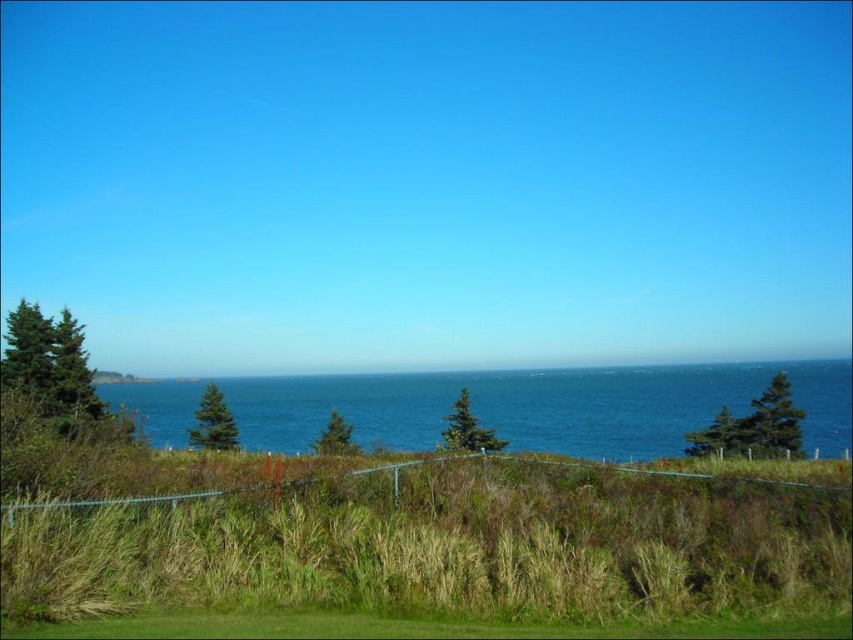
Question: Can you confirm if green grassy at lower center is positioned above blue water at center?

Choices:
 (A) yes
 (B) no

Answer: (A)

Question: Which point is farther to the camera?

Choices:
 (A) (363, 582)
 (B) (372, 408)

Answer: (B)

Question: Can you confirm if green grassy at lower center is positioned to the right of blue water at center?

Choices:
 (A) no
 (B) yes

Answer: (B)

Question: Does green grassy at lower center have a lesser width compared to blue water at center?

Choices:
 (A) yes
 (B) no

Answer: (A)